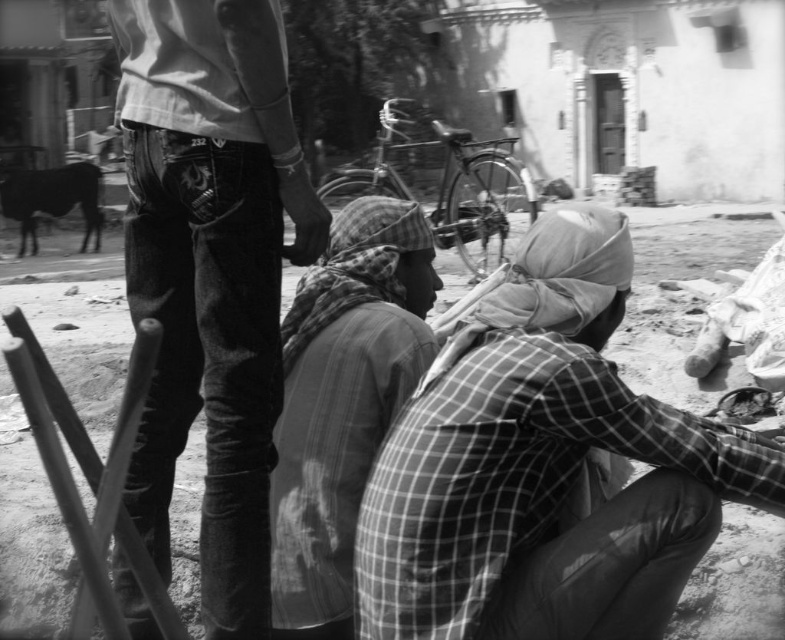
You are a photographer analyzing the composition of this black and white photo. You notice the checkered fabric headscarf at lower center and the jeans at center. Which object occupies a larger area in the image?

The jeans at center occupies a larger area in the image because the checkered fabric headscarf at lower center is smaller than jeans at center.